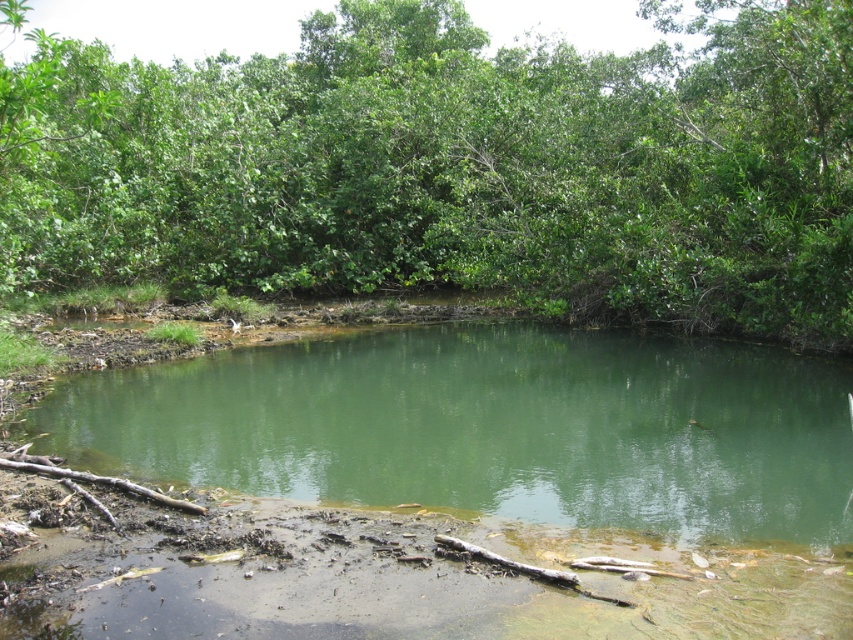
Is green leafy tree at upper center to the right of green muddy water at center from the viewer's perspective?

No, green leafy tree at upper center is not to the right of green muddy water at center.

Describe the element at coordinates (454, 168) in the screenshot. The width and height of the screenshot is (853, 640). I see `green leafy tree at upper center` at that location.

The width and height of the screenshot is (853, 640). What do you see at coordinates (454, 168) in the screenshot?
I see `green leafy tree at upper center` at bounding box center [454, 168].

Find the location of a particular element. The image size is (853, 640). green leafy tree at upper center is located at coordinates (454, 168).